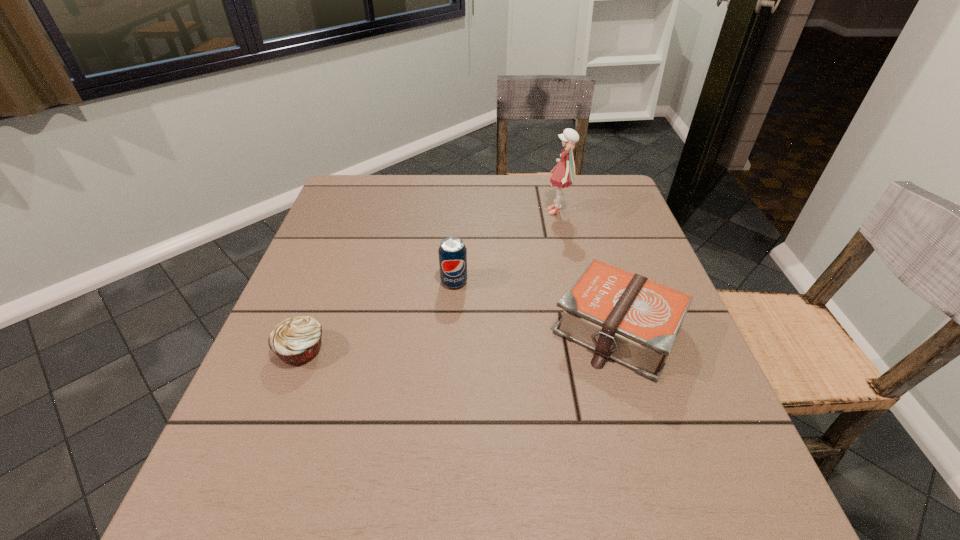
Where is `vacant region located on the left of the third shortest object`? vacant region located on the left of the third shortest object is located at coordinates (334, 282).

Identify the location of free region located 0.090m on the left of the second shortest object. Image resolution: width=960 pixels, height=540 pixels. (507, 329).

This screenshot has width=960, height=540. I want to click on vacant space located 0.100m on the back of the leftmost object, so click(322, 296).

In order to click on object present at the far edge in this screenshot , I will do `click(563, 176)`.

Find the location of `object situated at the left edge`. object situated at the left edge is located at coordinates (296, 340).

Find the location of a particular element. object at the right edge is located at coordinates (634, 321).

Where is `vacant space at the far edge of the desktop`? vacant space at the far edge of the desktop is located at coordinates (458, 211).

You are a GUI agent. You are given a task and a screenshot of the screen. Output one action in this format:
    pyautogui.click(x=<x>, y=<y>)
    Task: Click on the vacant region at the near edge
    The height and width of the screenshot is (540, 960).
    Given the screenshot: What is the action you would take?
    pyautogui.click(x=381, y=483)

Where is `blank space at the left edge of the desktop`? The width and height of the screenshot is (960, 540). blank space at the left edge of the desktop is located at coordinates (259, 386).

This screenshot has height=540, width=960. In the image, there is a desktop. Find the location of `free space at the right edge`. free space at the right edge is located at coordinates (729, 457).